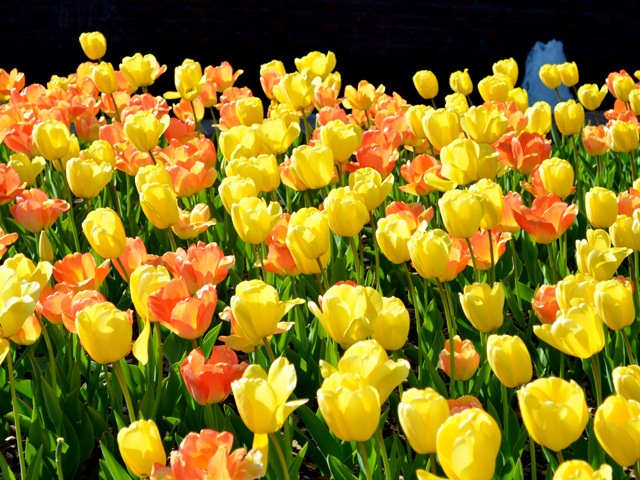
Find the location of a particular element. The width and height of the screenshot is (640, 480). bunch of flowers is located at coordinates (305, 275).